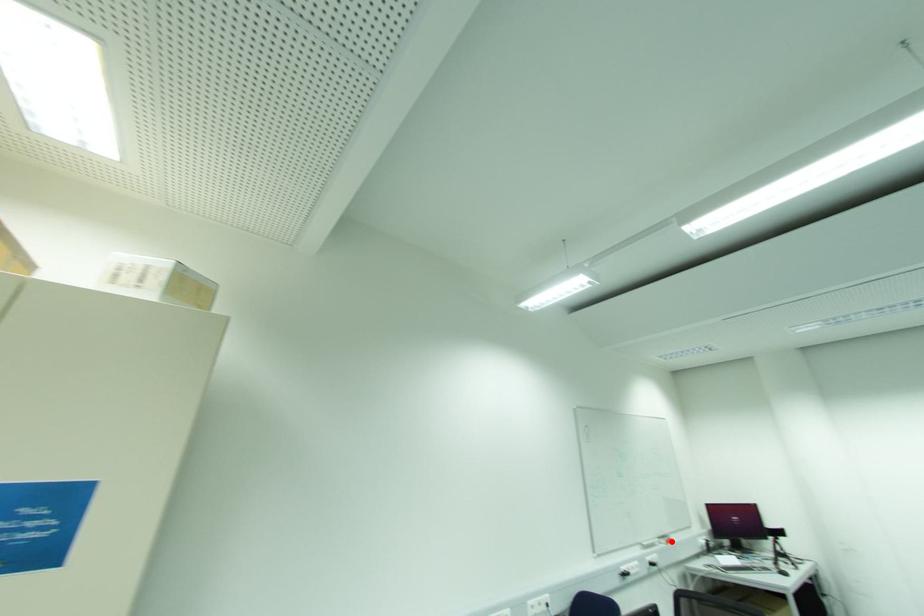
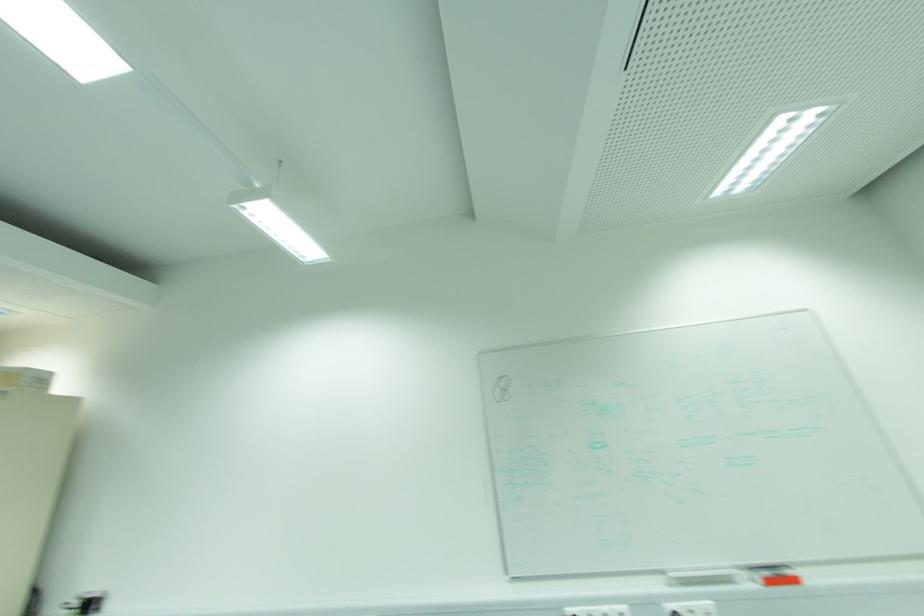
Question: I am providing you with two images of the same scene from different viewpoints. A red point is shown in image1. For the corresponding object point in image2, is it positioned nearer or farther from the camera?

Choices:
 (A) Nearer
 (B) Farther

Answer: (A)